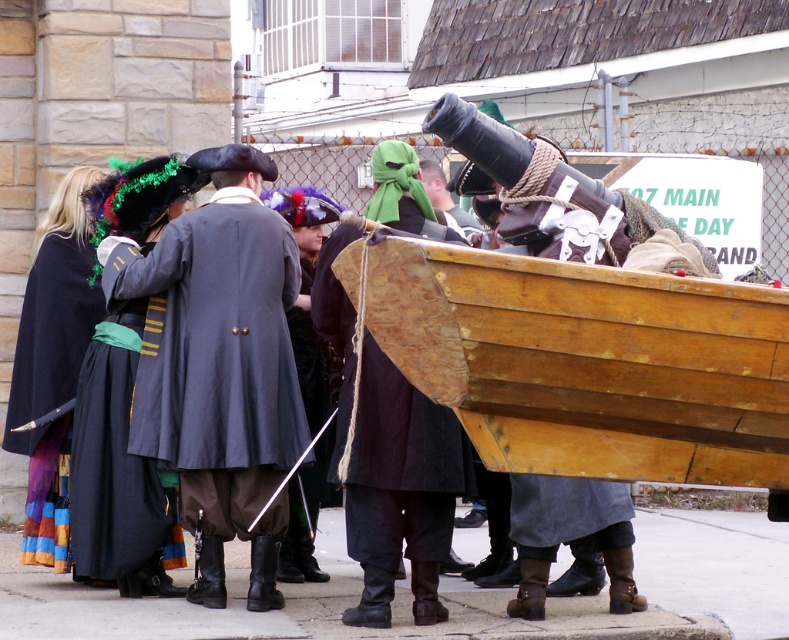
Question: Which point appears farthest from the camera in this image?

Choices:
 (A) (66, 211)
 (B) (297, 280)
 (C) (563, 296)

Answer: (A)

Question: Can you confirm if matte gray coat at center is bigger than matte black cape at left?

Choices:
 (A) no
 (B) yes

Answer: (B)

Question: Is wooden boat at center bigger than matte gray coat at center?

Choices:
 (A) yes
 (B) no

Answer: (A)

Question: Which point is closer to the camera?

Choices:
 (A) wooden boat at center
 (B) matte black cape at left
 (C) matte gray coat at center

Answer: (A)

Question: Can you confirm if matte gray coat at center is positioned to the left of matte black cape at left?

Choices:
 (A) no
 (B) yes

Answer: (A)

Question: Which of the following is the closest to the observer?

Choices:
 (A) (180, 346)
 (B) (739, 380)
 (C) (15, 406)

Answer: (B)